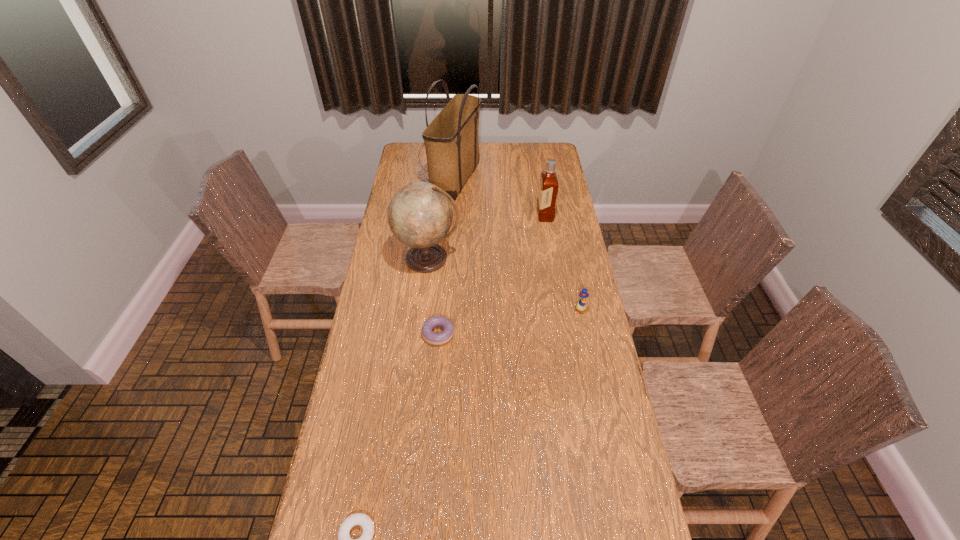
Locate an element on the screen. The image size is (960, 540). duckling that is at the right edge is located at coordinates (581, 305).

You are a GUI agent. You are given a task and a screenshot of the screen. Output one action in this format:
    pyautogui.click(x=<x>, y=<y>)
    Task: Click on the free space at the far edge of the desktop
    This screenshot has height=540, width=960.
    Given the screenshot: What is the action you would take?
    pyautogui.click(x=516, y=148)

Image resolution: width=960 pixels, height=540 pixels. In the image, there is a desktop. In order to click on vacant space at the left edge in this screenshot , I will do `click(352, 458)`.

This screenshot has height=540, width=960. In the image, there is a desktop. What are the coordinates of `vacant area at the right edge` in the screenshot? It's located at (561, 300).

In order to click on vacant area at the far left corner of the desktop in this screenshot , I will do `click(414, 160)`.

The height and width of the screenshot is (540, 960). I want to click on free space between the tallest object and the right doughnut, so click(447, 256).

Locate an element on the screen. The height and width of the screenshot is (540, 960). free space between the farther doughnut and the third shortest object is located at coordinates (509, 322).

You are a GUI agent. You are given a task and a screenshot of the screen. Output one action in this format:
    pyautogui.click(x=<x>, y=<y>)
    Task: Click on the vacant space that is in between the fifth object from left to right and the fourth nearest object
    Image resolution: width=960 pixels, height=540 pixels.
    Given the screenshot: What is the action you would take?
    pyautogui.click(x=487, y=237)

Identify the location of vacant space in between the fifth object from left to right and the tote bag. (500, 197).

You are a GUI agent. You are given a task and a screenshot of the screen. Output one action in this format:
    pyautogui.click(x=<x>, y=<y>)
    Task: Click on the vacant point located between the globe and the fifth object from left to right
    The image size is (960, 540).
    Given the screenshot: What is the action you would take?
    pyautogui.click(x=487, y=237)